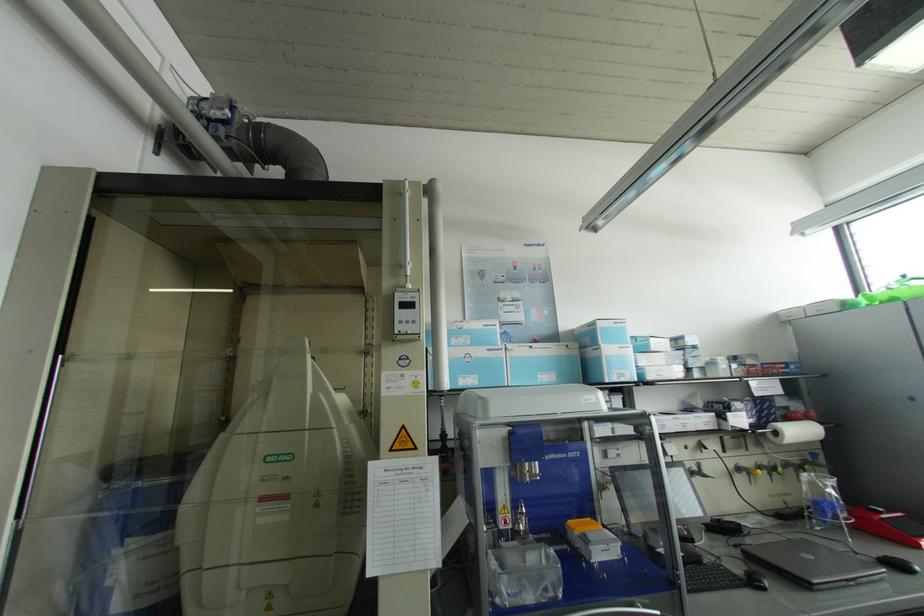
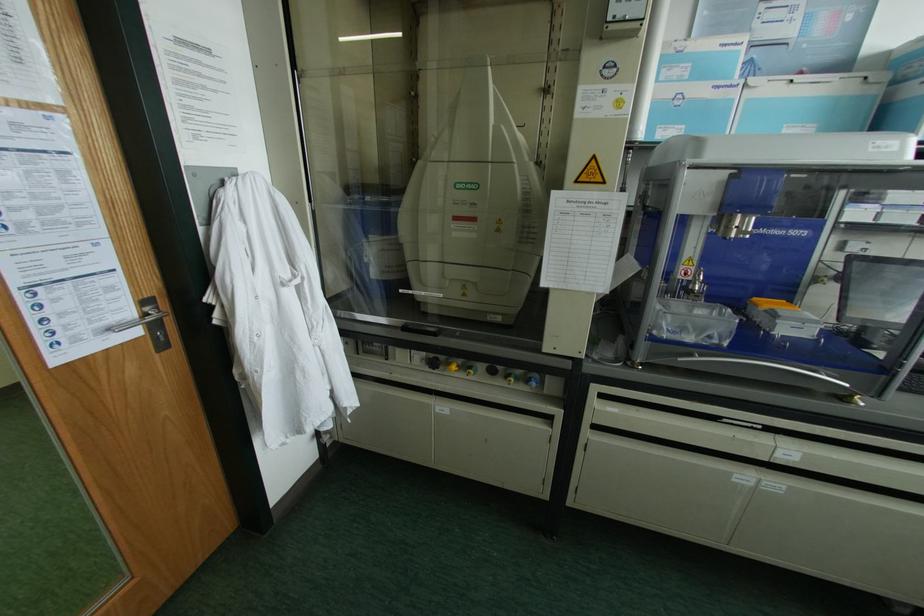
The point at [286,477] is marked in the first image. Where is the corresponding point in the second image?

(472, 204)